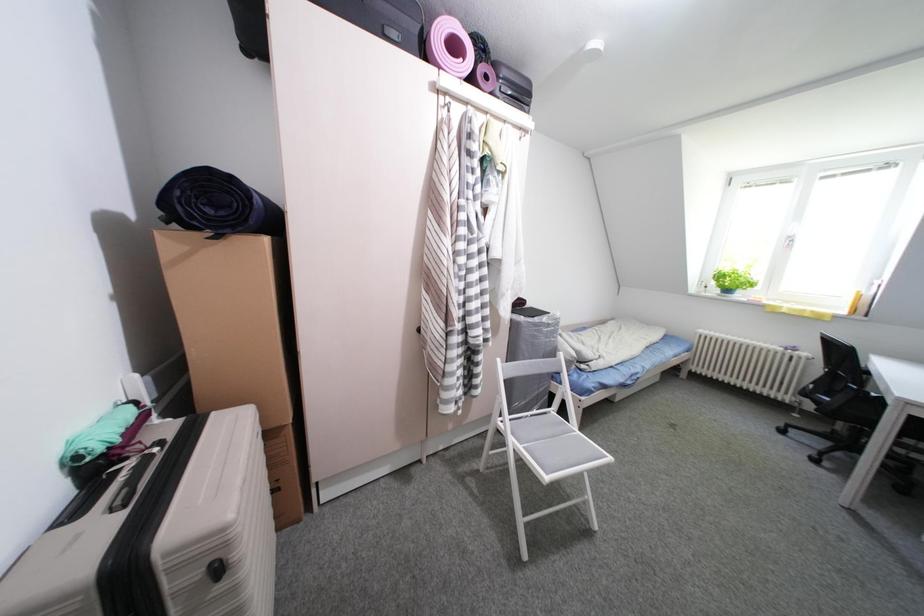
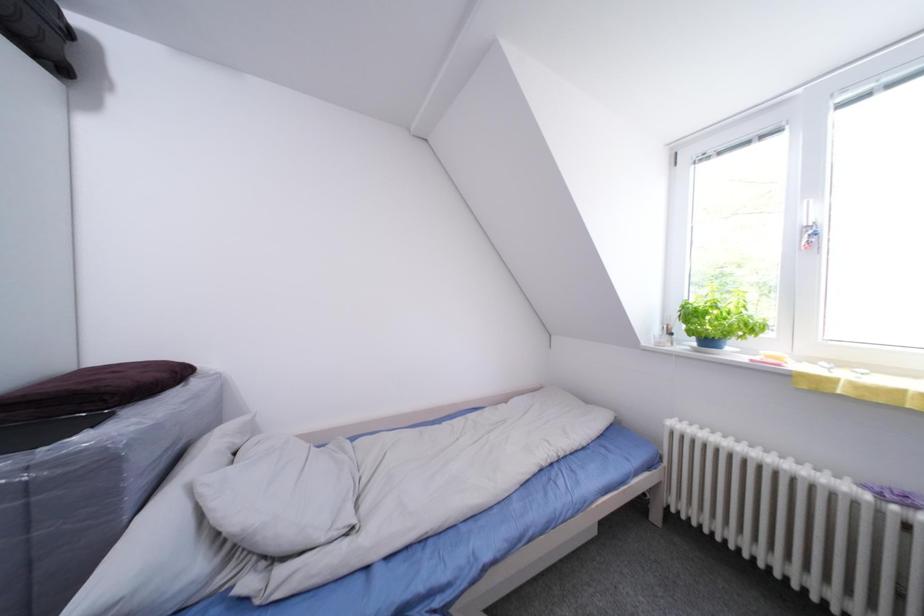
Looking at this image, what movement of the cameraman would produce the second image?

The cameraman walked toward right, forward.